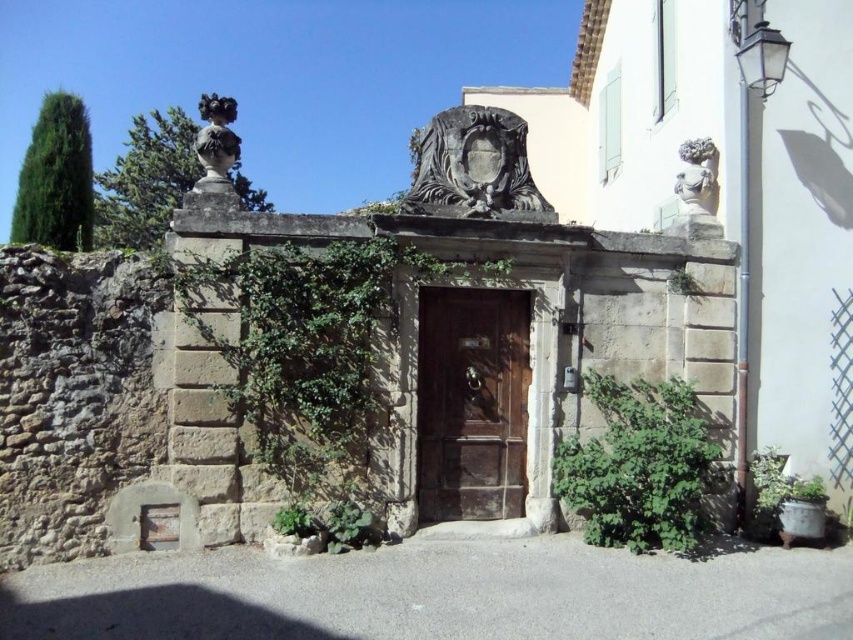
You are standing in front of the entrance and want to locate the white stone bust at upper right. Based on the wooden door at center, which direction should you turn your head to look for it?

Since the wooden door at center is to the left of the white stone bust at upper right, you should turn your head to the right to locate the white stone bust at upper right.

You are a painter standing at the entrance of the historic building. You need to paint both the wooden door at center and the white stone bust at upper right. Which object will require you to lift your brush higher to reach its top?

The wooden door at center is taller than the white stone bust at upper right, so you will need to lift your brush higher to reach the top of the wooden door at center.